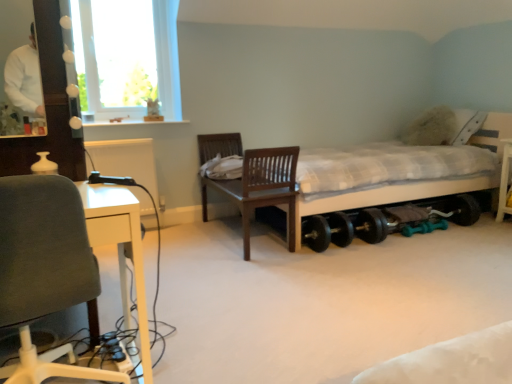
The image size is (512, 384). What do you see at coordinates (387, 196) in the screenshot?
I see `white checkered bed at center` at bounding box center [387, 196].

In order to face black rubber wheel at lower center, should I rotate leftwards or rightwards?

Turn right by 22.669 degrees to look at black rubber wheel at lower center.

Measure the distance between point (x=16, y=106) and camera.

Point (x=16, y=106) is 1.60 meters away from camera.

What is the approximate height of white matte sweater at upper left?

white matte sweater at upper left is 19.54 inches in height.

Find the location of a particular element. Image resolution: width=512 pixels, height=384 pixels. gray fabric chair at left, arranged as the 2th chair when viewed from the back is located at coordinates (44, 266).

Which is nearer, (496,129) or (265,202)?

Clearly, point (496,129) is more distant from the camera than point (265,202).

Does white checkered bed at center have a greater width compared to wooden chair at center, placed as the first chair when sorted from right to left?

Correct, the width of white checkered bed at center exceeds that of wooden chair at center, placed as the first chair when sorted from right to left.

Based on the photo, from the image's perspective, is white checkered bed at center located above or below wooden chair at center, the first chair from the back?

white checkered bed at center is above wooden chair at center, the first chair from the back.

Is white checkered bed at center in front of or behind wooden chair at center, placed as the first chair when sorted from right to left, in the image?

white checkered bed at center is behind wooden chair at center, placed as the first chair when sorted from right to left.

Considering the sizes of objects white checkered bed at center and gray fabric chair at left, the first chair when ordered from front to back, in the image provided, who is bigger, white checkered bed at center or gray fabric chair at left, the first chair when ordered from front to back,?

white checkered bed at center is bigger.

Is the position of white checkered bed at center less distant than that of gray fabric chair at left, the first chair when ordered from front to back?

No, it is behind gray fabric chair at left, the first chair when ordered from front to back.

Are white checkered bed at center and gray fabric chair at left, the first chair when ordered from front to back, beside each other?

white checkered bed at center is not next to gray fabric chair at left, the first chair when ordered from front to back, and they're not touching.

In the scene shown: Is white checkered bed at center wider than gray fabric chair at left, positioned as the second chair in right-to-left order?

Yes, white checkered bed at center is wider than gray fabric chair at left, positioned as the second chair in right-to-left order.

From the image's perspective, is white checkered bed at center on white matte sweater at upper left?

Incorrect, from the image's perspective, white checkered bed at center is lower than white matte sweater at upper left.

Is white checkered bed at center shorter than white matte sweater at upper left?

In fact, white checkered bed at center may be taller than white matte sweater at upper left.

Is white checkered bed at center facing towards white matte sweater at upper left?

Yes, white checkered bed at center faces towards white matte sweater at upper left.

Looking at this image, from a real-world perspective, is white matte sweater at upper left located higher than white glass window at upper left?

Actually, white matte sweater at upper left is physically below white glass window at upper left in the real world.

In the scene shown: Is white matte sweater at upper left facing away from white glass window at upper left?

No, white matte sweater at upper left is not facing the opposite direction of white glass window at upper left.

From the image's perspective, is white matte sweater at upper left located above white glass window at upper left?

No.

From the picture: Considering the sizes of objects white matte sweater at upper left and white glass window at upper left in the image provided, who is thinner, white matte sweater at upper left or white glass window at upper left?

With smaller width is white matte sweater at upper left.

In the scene shown: Is white checkered bed at center a part of white glass window at upper left?

No, white checkered bed at center is not inside white glass window at upper left.

Considering the sizes of white glass window at upper left and white checkered bed at center in the image, is white glass window at upper left bigger or smaller than white checkered bed at center?

white glass window at upper left is smaller than white checkered bed at center.

Is white checkered bed at center at the back of white glass window at upper left?

A: white glass window at upper left does not have its back to white checkered bed at center.

From a real-world perspective, is white glass window at upper left positioned over wooden chair at center, placed as the first chair when sorted from right to left, based on gravity?

Yes.

Would you consider white glass window at upper left to be distant from wooden chair at center, the 2th chair in the front-to-back sequence?

white glass window at upper left is positioned a significant distance from wooden chair at center, the 2th chair in the front-to-back sequence.

Is wooden chair at center, placed as the first chair when sorted from right to left, completely or partially inside white glass window at upper left?

No, wooden chair at center, placed as the first chair when sorted from right to left, is not a part of white glass window at upper left.

From the image's perspective, which is below, black rubber wheel at lower center or wooden chair at center, which is the second chair in left-to-right order?

black rubber wheel at lower center appears lower in the image.

From a real-world perspective, is black rubber wheel at lower center on top of wooden chair at center, placed as the first chair when sorted from right to left?

No, from a real-world perspective, black rubber wheel at lower center is not on top of wooden chair at center, placed as the first chair when sorted from right to left.

Can you tell me how much black rubber wheel at lower center and wooden chair at center, the 2th chair in the front-to-back sequence, differ in facing direction?

They differ by 89.4 degrees in their facing directions.

Considering the positions of points (428, 225) and (257, 156), is point (428, 225) closer to camera compared to point (257, 156)?

No, it is not.

You are a GUI agent. You are given a task and a screenshot of the screen. Output one action in this format:
    pyautogui.click(x=<x>, y=<y>)
    Task: Click on the bed located above the wooden chair at center, the first chair from the back (from the image's perspective)
    The image size is (512, 384).
    Given the screenshot: What is the action you would take?
    pyautogui.click(x=387, y=196)

You are a GUI agent. You are given a task and a screenshot of the screen. Output one action in this format:
    pyautogui.click(x=<x>, y=<y>)
    Task: Click on the 2nd chair in front of the white checkered bed at center, counting from the anchor's position
    This screenshot has height=384, width=512.
    Given the screenshot: What is the action you would take?
    pyautogui.click(x=44, y=266)

Estimate the real-world distances between objects in this image. Which object is closer to white glass window at upper left, white checkered bed at center or gray fabric chair at left, which appears as the 1th chair when viewed from the left?

→ white checkered bed at center lies closer to white glass window at upper left than the other object.

Considering their positions, is gray fabric chair at left, the first chair when ordered from front to back, positioned further to wooden chair at center, the first chair from the back, than white glass window at upper left?

Based on the image, gray fabric chair at left, the first chair when ordered from front to back, appears to be further to wooden chair at center, the first chair from the back.

Looking at the image, which one is located closer to white glass window at upper left, wooden chair at center, the 2th chair in the front-to-back sequence, or gray fabric chair at left, the first chair when ordered from front to back?

A: Among the two, wooden chair at center, the 2th chair in the front-to-back sequence, is located nearer to white glass window at upper left.

When comparing their distances from white glass window at upper left, does gray fabric chair at left, the first chair when ordered from front to back, or white checkered bed at center seem closer?

Based on the image, white checkered bed at center appears to be nearer to white glass window at upper left.

Which object lies nearer to the anchor point gray fabric chair at left, the first chair when ordered from front to back, black rubber wheel at lower center or white checkered bed at center?

Among the two, white checkered bed at center is located nearer to gray fabric chair at left, the first chair when ordered from front to back.

From the image, which object appears to be nearer to white checkered bed at center, gray fabric chair at left, arranged as the 2th chair when viewed from the back, or white matte sweater at upper left?

white matte sweater at upper left is closer to white checkered bed at center.

Estimate the real-world distances between objects in this image. Which object is further from black rubber wheel at lower center, gray fabric chair at left, arranged as the 2th chair when viewed from the back, or white glass window at upper left?

gray fabric chair at left, arranged as the 2th chair when viewed from the back.

Considering their positions, is black rubber wheel at lower center positioned further to white checkered bed at center than white glass window at upper left?

white glass window at upper left lies further to white checkered bed at center than the other object.

Image resolution: width=512 pixels, height=384 pixels. What are the coordinates of `bed between wooden chair at center, the 2th chair in the front-to-back sequence, and black rubber wheel at lower center, in the horizontal direction` in the screenshot? It's located at (387, 196).

In order to click on person between gray fabric chair at left, positioned as the second chair in right-to-left order, and white glass window at upper left, along the z-axis in this screenshot , I will do (x=25, y=79).

Locate an element on the screen. Image resolution: width=512 pixels, height=384 pixels. bed between gray fabric chair at left, the first chair when ordered from front to back, and black rubber wheel at lower center is located at coordinates (387, 196).

Where is `person between gray fabric chair at left, the first chair when ordered from front to back, and wooden chair at center, the 2th chair in the front-to-back sequence, along the z-axis`? person between gray fabric chair at left, the first chair when ordered from front to back, and wooden chair at center, the 2th chair in the front-to-back sequence, along the z-axis is located at coordinates (25, 79).